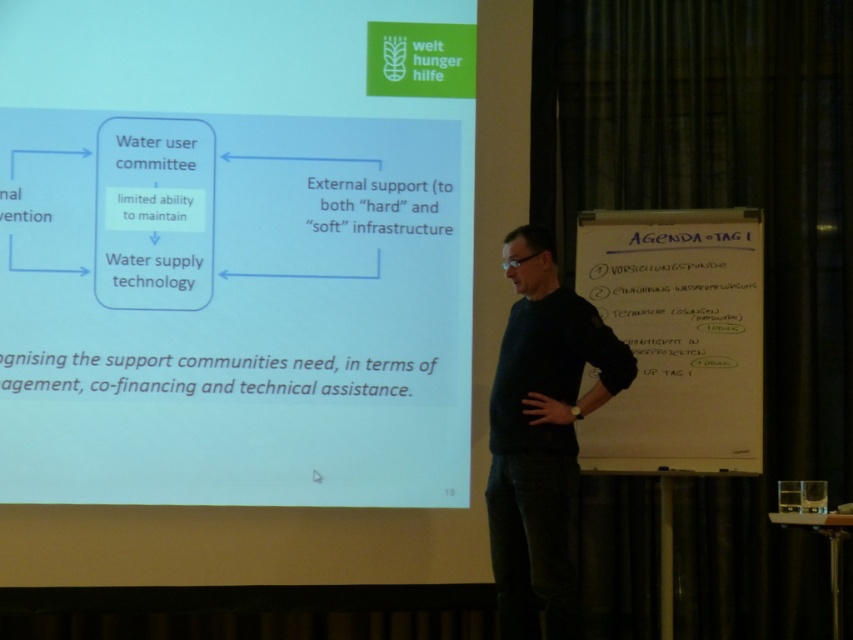
Is blue paper at upper center to the right of whiteboard at right from the viewer's perspective?

In fact, blue paper at upper center is to the left of whiteboard at right.

Between blue paper at upper center and whiteboard at right, which one appears on the right side from the viewer's perspective?

whiteboard at right is more to the right.

Between point (207, 355) and point (720, 376), which one is positioned behind?

The point (207, 355) is more distant.

This screenshot has height=640, width=853. Identify the location of blue paper at upper center. (234, 253).

How much distance is there between blue paper at upper center and dark blue sweater at center?

The distance of blue paper at upper center from dark blue sweater at center is 35.96 inches.

Does blue paper at upper center have a smaller size compared to dark blue sweater at center?

No.

Where is `blue paper at upper center`? The image size is (853, 640). blue paper at upper center is located at coordinates (234, 253).

Does whiteboard at right appear on the right side of dark blue sweater at center?

Yes, whiteboard at right is to the right of dark blue sweater at center.

Who is more forward, (590, 237) or (552, 502)?

Point (552, 502)

The image size is (853, 640). Identify the location of whiteboard at right. (677, 337).